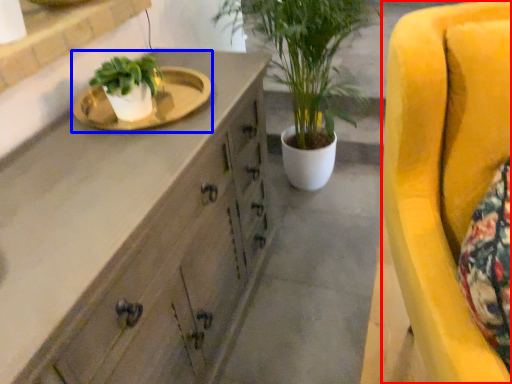
Question: Which of the following is the farthest to the observer, chair (highlighted by a red box) or sink (highlighted by a blue box)?

Choices:
 (A) chair
 (B) sink

Answer: (B)